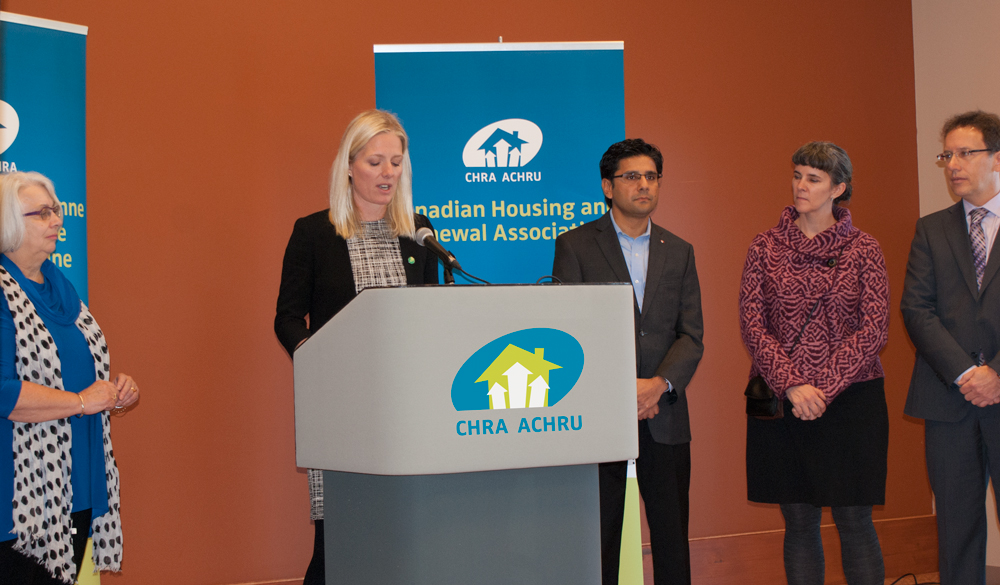
At what (x,y) coordinates should I click in order to perform the action: click on speaker. Please return your answer as a coordinate pair (x, y). This screenshot has width=1000, height=585. Looking at the image, I should click on (374, 153).